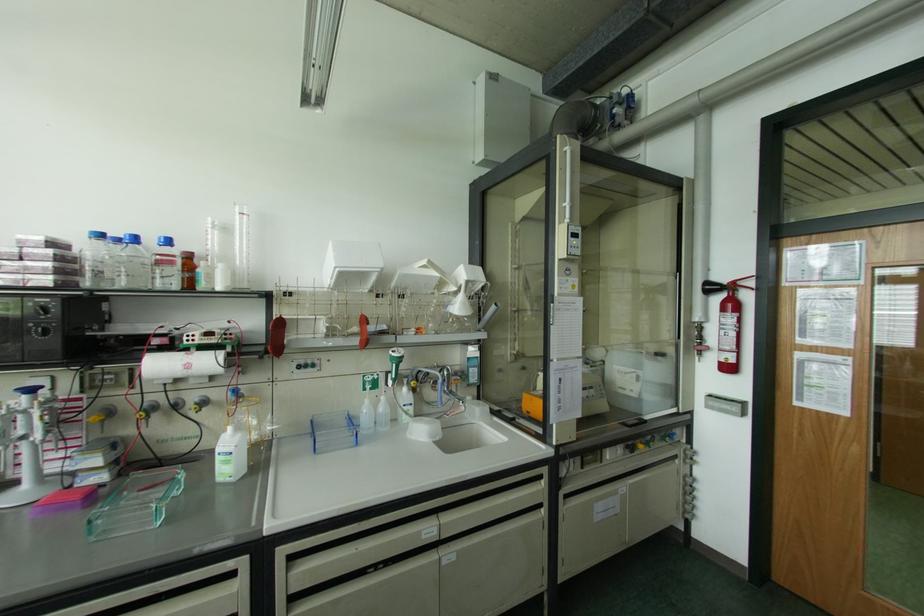
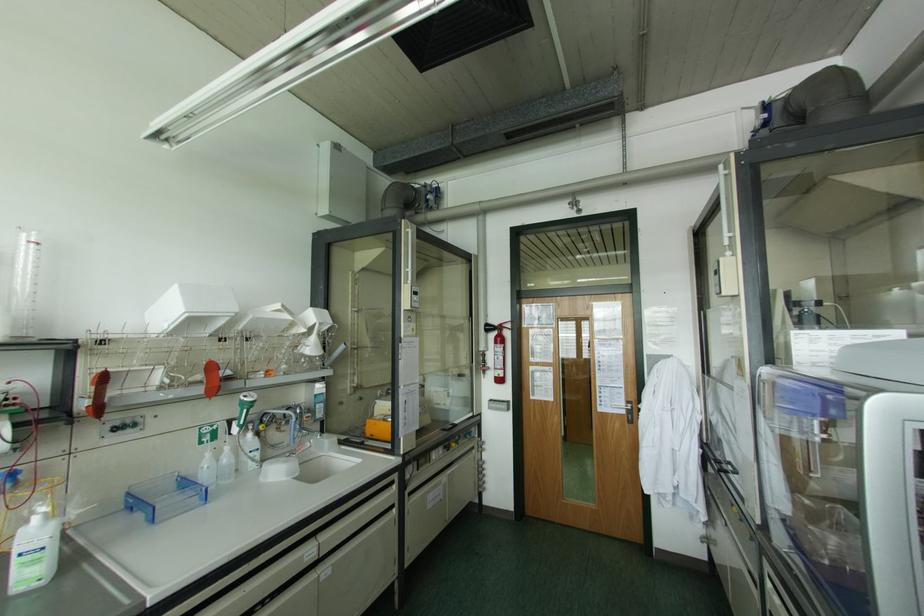
Find the pixel in the second image that matches the point at 427,529 in the first image.

(308, 552)